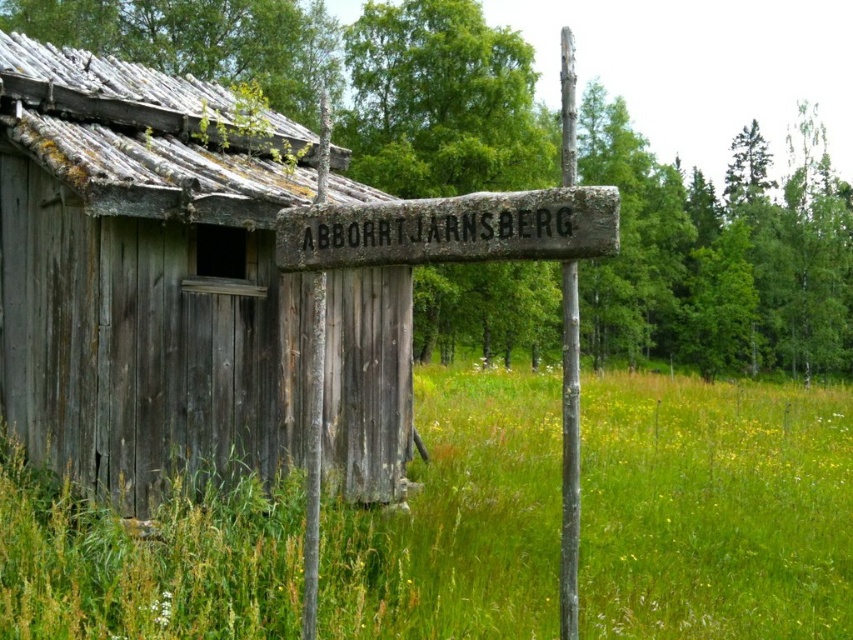
Is green grassy field at center below weathered wood sign at center?

Yes.

Is green grassy field at center further to camera compared to weathered wood sign at center?

Yes, it is behind weathered wood sign at center.

Does point (54, 506) come farther from viewer compared to point (466, 230)?

Yes, point (54, 506) is behind point (466, 230).

This screenshot has width=853, height=640. I want to click on green grassy field at center, so click(714, 509).

Does point (163, 273) lie behind point (480, 218)?

That is True.

Where is `weathered wood hut at center`? The image size is (853, 640). weathered wood hut at center is located at coordinates (144, 272).

The width and height of the screenshot is (853, 640). Find the location of `green grassy field at center`. green grassy field at center is located at coordinates (714, 509).

Locate an element on the screen. The height and width of the screenshot is (640, 853). green grassy field at center is located at coordinates (714, 509).